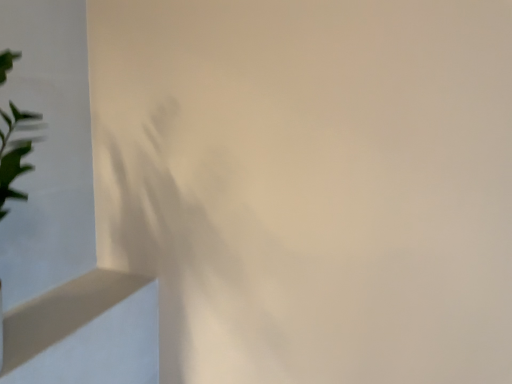
Describe the element at coordinates (85, 332) in the screenshot. Image resolution: width=512 pixels, height=384 pixels. I see `white matte shelf at lower left` at that location.

Find the location of a particular element. This screenshot has width=512, height=384. white matte shelf at lower left is located at coordinates (85, 332).

What are the coordinates of `white matte shelf at lower left` in the screenshot? It's located at (85, 332).